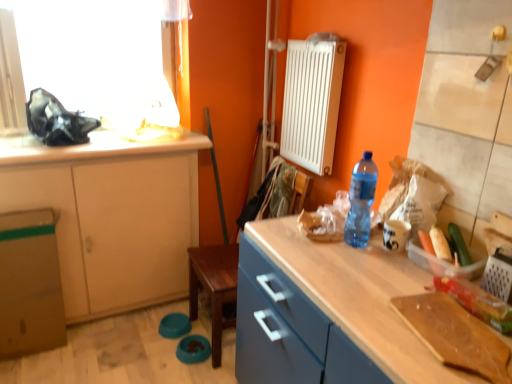
Locate an element on the screen. The width and height of the screenshot is (512, 384). vacant location below brown cardboard box at lower left (from a real-world perspective) is located at coordinates (45, 346).